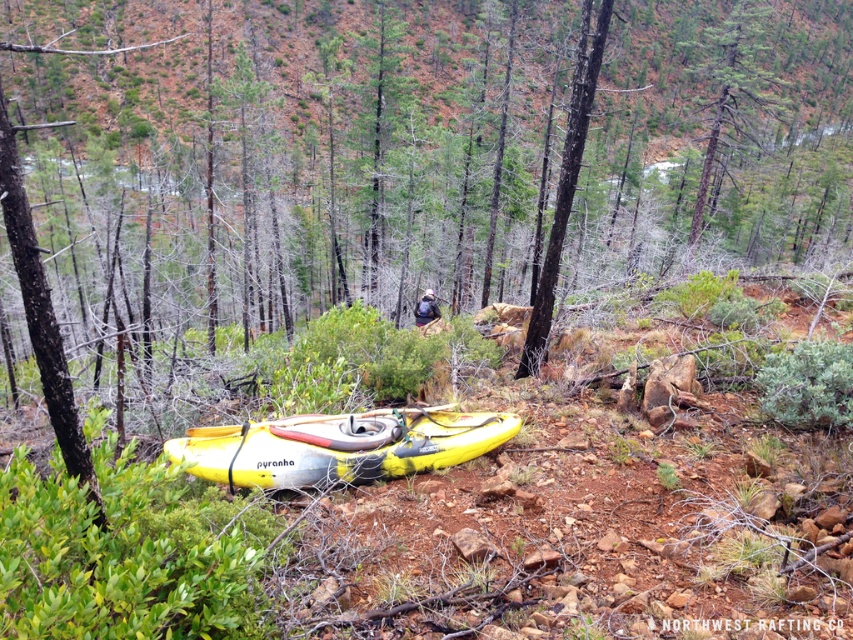
You are a hiker who has just arrived at the scene. You notice two trees in the distance. The smooth brown tree trunk at upper center and the smooth bark tree at center. Which tree is closer to you?

The smooth bark tree at center is behind the smooth brown tree trunk at upper center, so the smooth brown tree trunk at upper center is closer to you.

You are standing at the yellow kayak with black accents and the word pyranha printed on its side. You see two points in the scene, point (408, 468) and point (526, 349). Which point is closer to you?

Point (408, 468) is closer to you than point (526, 349).